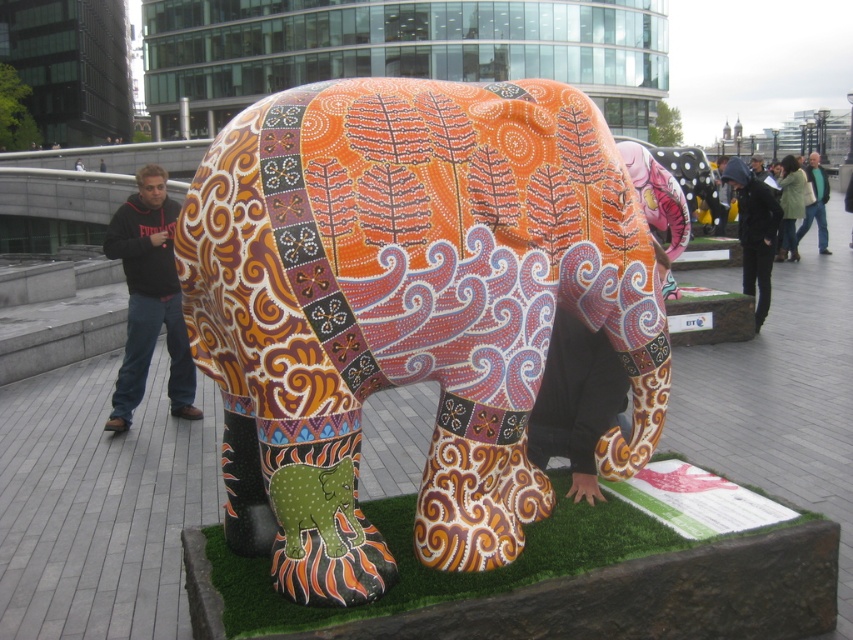
Does point (610, 561) lie in front of point (747, 179)?

Yes, point (610, 561) is closer to viewer.

The width and height of the screenshot is (853, 640). I want to click on green artificial turf at center, so (453, 572).

Is painted ceramic elephant at center positioned before green artificial turf at center?

No, it is behind green artificial turf at center.

Does painted ceramic elephant at center have a greater height compared to green artificial turf at center?

Yes, painted ceramic elephant at center is taller than green artificial turf at center.

The height and width of the screenshot is (640, 853). I want to click on painted ceramic elephant at center, so click(x=405, y=308).

Locate an element on the screen. Image resolution: width=853 pixels, height=640 pixels. painted ceramic elephant at center is located at coordinates (405, 308).

Does green artificial turf at center have a lesser width compared to jeans at center?

No, green artificial turf at center is not thinner than jeans at center.

Which of these two, green artificial turf at center or jeans at center, stands taller?

jeans at center

Between point (641, 531) and point (811, 166), which one is positioned behind?

The point (811, 166) is behind.

In order to click on green artificial turf at center in this screenshot , I will do `click(453, 572)`.